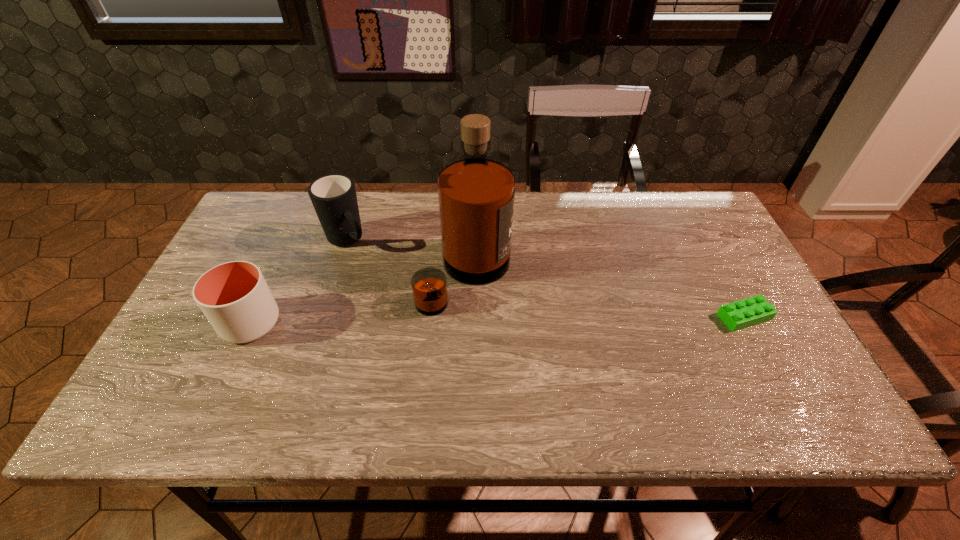
Image resolution: width=960 pixels, height=540 pixels. I want to click on free space between the second tallest object and the third tallest object, so (299, 281).

You are a GUI agent. You are given a task and a screenshot of the screen. Output one action in this format:
    pyautogui.click(x=<x>, y=<y>)
    Task: Click on the vacant area that lies between the tallest object and the cup
    The image size is (960, 540).
    Given the screenshot: What is the action you would take?
    pyautogui.click(x=358, y=299)

You are a GUI agent. You are given a task and a screenshot of the screen. Output one action in this format:
    pyautogui.click(x=<x>, y=<y>)
    Task: Click on the empty space that is in between the second shortest object and the rightmost object
    The image size is (960, 540).
    Given the screenshot: What is the action you would take?
    pyautogui.click(x=497, y=320)

At what (x,y) coordinates should I click in order to perform the action: click on free area in between the second object from left to right and the third tallest object. Please return your answer as a coordinate pair (x, y). This screenshot has height=540, width=960. Looking at the image, I should click on (299, 281).

Identify the location of empty location between the shortest object and the mug. The width and height of the screenshot is (960, 540). (545, 279).

Where is `unoccupied area between the Lego and the second object from right to left`? This screenshot has height=540, width=960. unoccupied area between the Lego and the second object from right to left is located at coordinates (605, 296).

Locate which object is the closest to the Lego. Please provide its 2D coordinates. Your answer should be formatted as a tuple, i.e. [(x, y)], where the tuple contains the x and y coordinates of a point satisfying the conditions above.

[(476, 194)]

Locate an element on the screen. object identified as the second closest to the rightmost object is located at coordinates click(334, 198).

You are a GUI agent. You are given a task and a screenshot of the screen. Output one action in this format:
    pyautogui.click(x=<x>, y=<y>)
    Task: Click on the vacant space that satisfies the following two spatial constraints: 1. on the back side of the second shortest object; 2. on the left side of the shortest object
    The width and height of the screenshot is (960, 540).
    Given the screenshot: What is the action you would take?
    tap(253, 317)

The image size is (960, 540). I want to click on free space in the image that satisfies the following two spatial constraints: 1. on the back side of the Lego; 2. on the left side of the cup, so click(x=253, y=317).